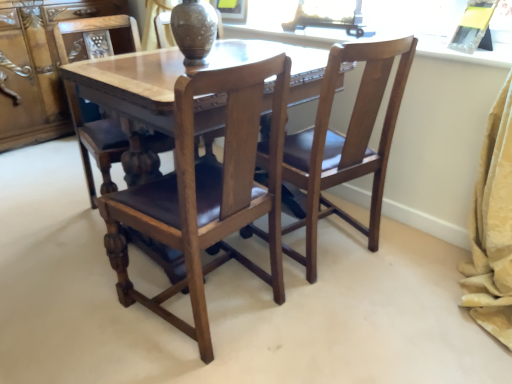
At what (x,y) coordinates should I click in order to perform the action: click on vacant space underneath wooden chair at center, which appears as the third chair when viewed from the left (from a real-world perspective). Please return your answer as a coordinate pair (x, y). The height and width of the screenshot is (384, 512). Looking at the image, I should click on (338, 249).